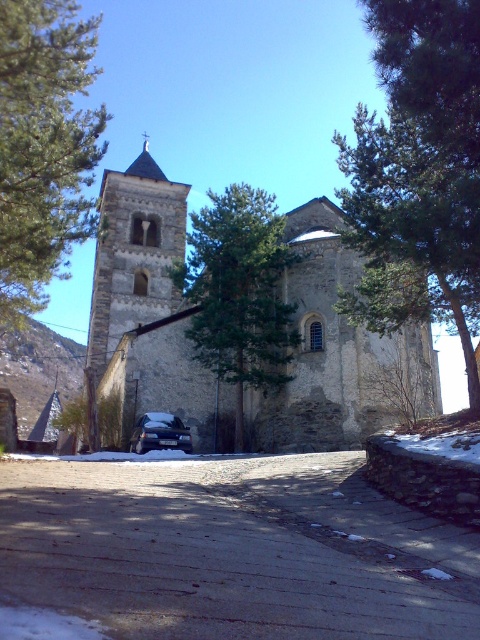
Question: Is green leafy tree at left smaller than stone tower at center?

Choices:
 (A) yes
 (B) no

Answer: (A)

Question: Does stone church at center appear on the right side of stone tower at center?

Choices:
 (A) yes
 (B) no

Answer: (A)

Question: Estimate the real-world distances between objects in this image. Which object is farther from the green leafy tree at left?

Choices:
 (A) green leafy tree at upper right
 (B) satin black car at center

Answer: (A)

Question: Based on their relative distances, which object is farther from the stone church at center?

Choices:
 (A) green leafy tree at left
 (B) stone tower at center
 (C) green textured tree at center

Answer: (A)

Question: Is stone church at center bigger than satin black car at center?

Choices:
 (A) yes
 (B) no

Answer: (A)

Question: Which of the following is the closest to the observer?

Choices:
 (A) (169, 182)
 (B) (459, 92)

Answer: (B)